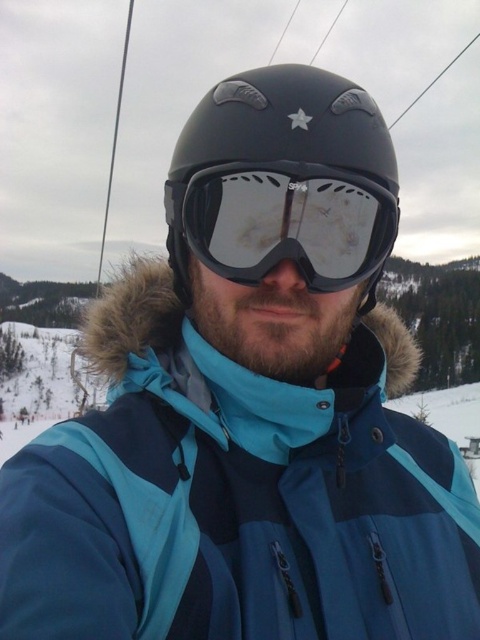
You are a photographer trying to capture the blue synthetic jacket at center and the matte black goggles at center in a single photo. Since the camera can only focus on one object at a time, which object should you focus on to ensure the other remains in the background?

You should focus on the blue synthetic jacket at center because it is in front of the matte black goggles at center, so the goggles will naturally be in the background when the jacket is in focus.

You are a photographer trying to capture the person in the scene. You want to ensure that both the blue synthetic jacket at center and the matte black helmet at center are clearly visible in your photo. Given their positions, which object should you focus on first to ensure both are in focus?

The blue synthetic jacket at center is below the matte black helmet at center. Since the helmet is above the jacket, focusing on the helmet first will ensure both are in focus as the jacket is positioned below it.

You are standing in front of the person in the winter sports gear. You notice two points marked on their clothing. One is at coordinate point (402, 458) and the other at point (219, 195). Which point is closer to you?

Point (402, 458) is further to the viewer than point (219, 195), so the point at (219, 195) is closer to you.